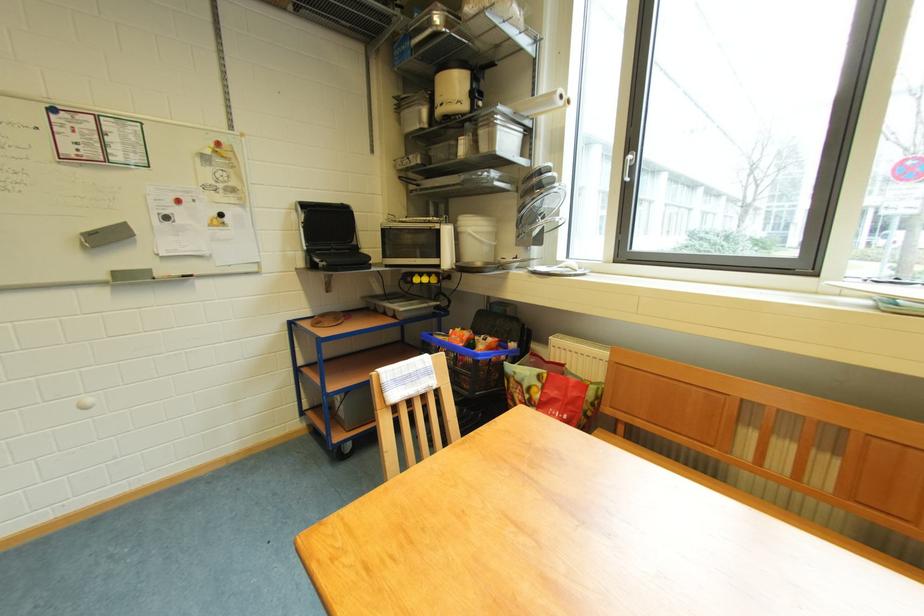
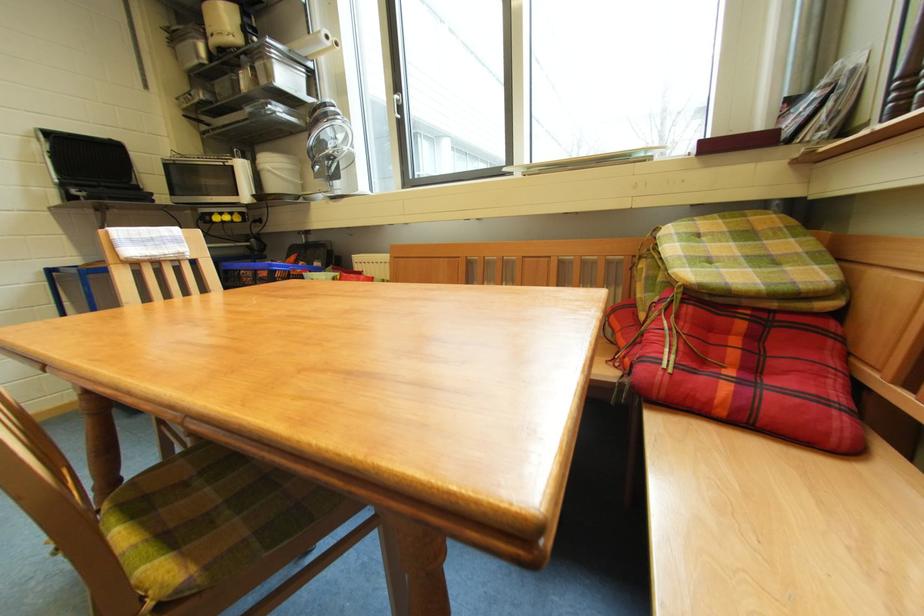
Where in the second image is the point corresponding to (497,363) from the first image?

(296, 274)